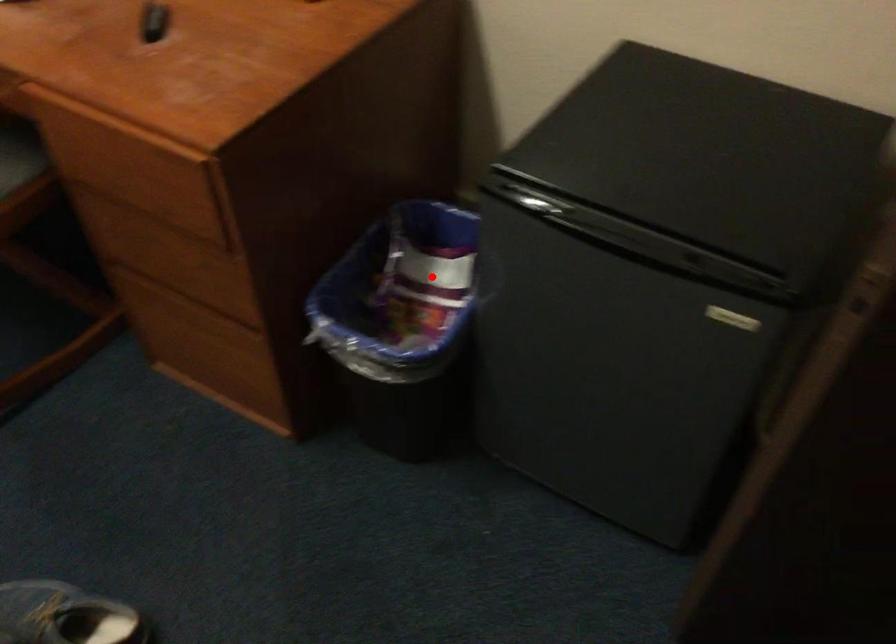
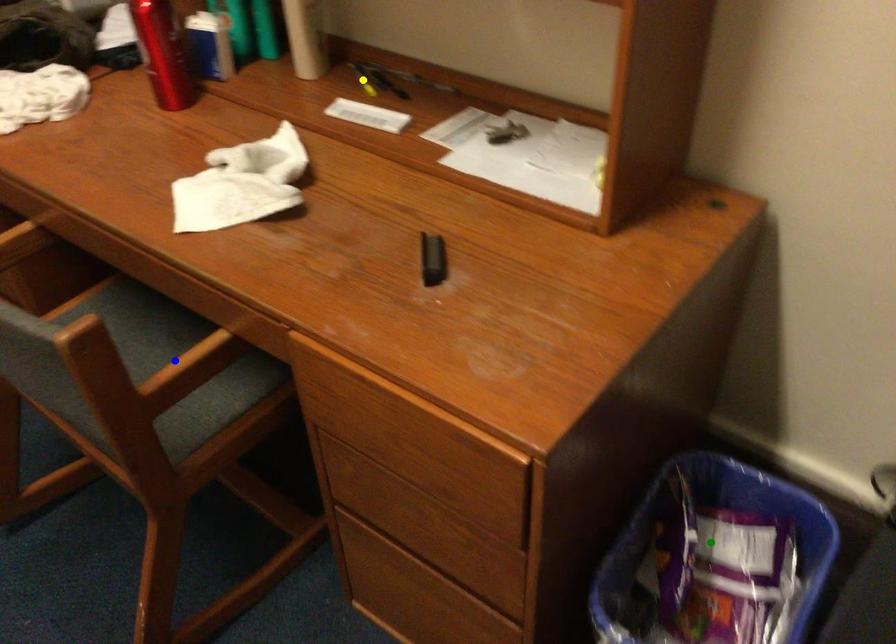
Question: I am providing you with two images of the same scene from different viewpoints. A red point is marked on the first image. You are given multiple points on the second image. Which point in image 2 represents the same 3d spot as the red point in image 1?

Choices:
 (A) green point
 (B) yellow point
 (C) blue point

Answer: (A)